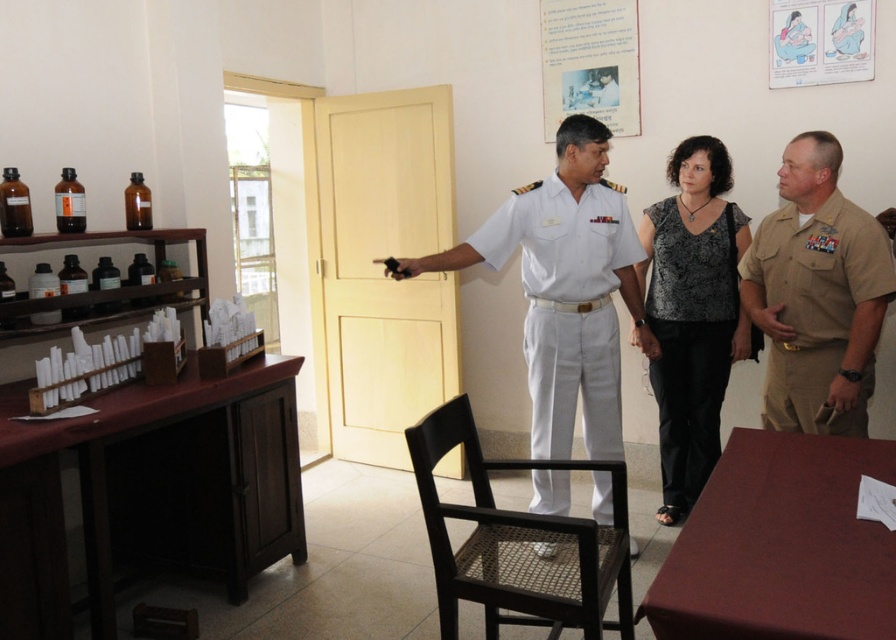
Which of these two, burgundy fabric table at lower right or black woven wood chair at center, stands taller?

black woven wood chair at center

What do you see at coordinates (780, 545) in the screenshot? I see `burgundy fabric table at lower right` at bounding box center [780, 545].

Identify the location of burgundy fabric table at lower right. This screenshot has width=896, height=640. (780, 545).

Can you confirm if burgundy fabric table at lower right is thinner than tan uniform shirt at right?

In fact, burgundy fabric table at lower right might be wider than tan uniform shirt at right.

Does burgundy fabric table at lower right appear under tan uniform shirt at right?

Yes.

I want to click on burgundy fabric table at lower right, so click(780, 545).

Can you confirm if burgundy fabric table at lower right is thinner than white cotton uniform at center?

Incorrect, burgundy fabric table at lower right's width is not less than white cotton uniform at center's.

Is burgundy fabric table at lower right behind white cotton uniform at center?

No.

This screenshot has width=896, height=640. What are the coordinates of `burgundy fabric table at lower right` in the screenshot? It's located at (780, 545).

Locate an element on the screen. burgundy fabric table at lower right is located at coordinates (780, 545).